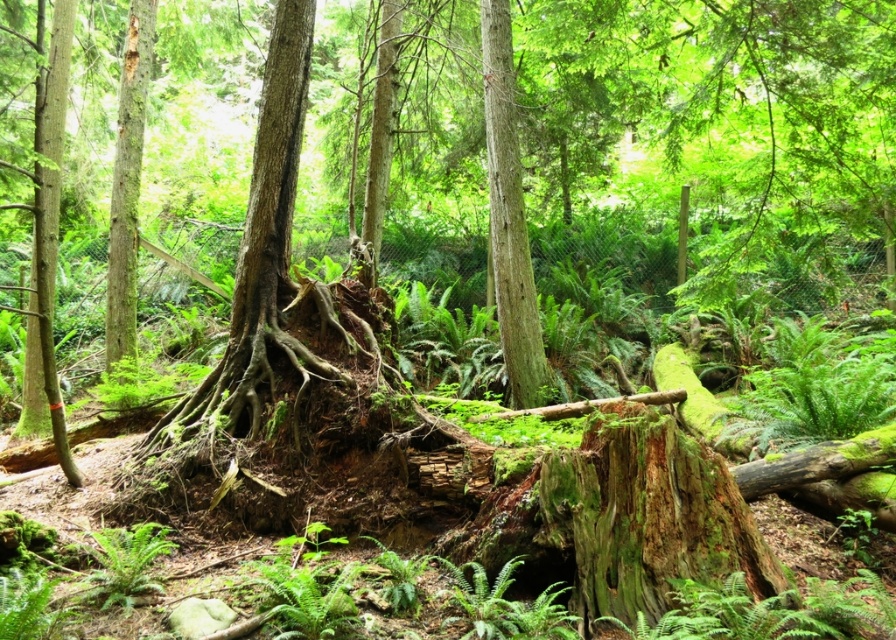
Who is lower down, smooth brown tree trunk at center or smooth brown tree trunk at left?

smooth brown tree trunk at center is below.

Between point (494, 204) and point (136, 80), which one is positioned behind?

The point (136, 80) is behind.

Identify the location of smooth brown tree trunk at center. This screenshot has height=640, width=896. (509, 216).

Does smooth brown tree trunk at center have a lesser width compared to green fuzzy fern at lower left?

In fact, smooth brown tree trunk at center might be wider than green fuzzy fern at lower left.

Between smooth brown tree trunk at center and green fuzzy fern at lower left, which one has more height?

Standing taller between the two is smooth brown tree trunk at center.

Where is `smooth brown tree trunk at center`? This screenshot has height=640, width=896. smooth brown tree trunk at center is located at coordinates (509, 216).

What do you see at coordinates (127, 182) in the screenshot?
I see `smooth brown tree trunk at left` at bounding box center [127, 182].

In the scene shown: Can you confirm if smooth brown tree trunk at left is smaller than green fuzzy fern at lower left?

Actually, smooth brown tree trunk at left might be larger than green fuzzy fern at lower left.

Who is more forward, (117, 323) or (151, 540)?

Point (151, 540)

This screenshot has height=640, width=896. Find the location of `smooth brown tree trunk at left`. smooth brown tree trunk at left is located at coordinates (127, 182).